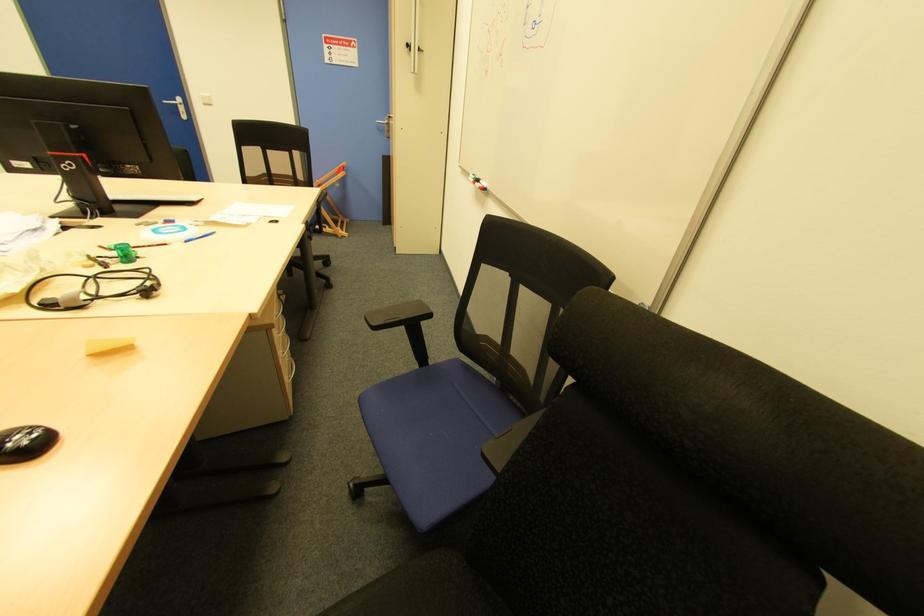
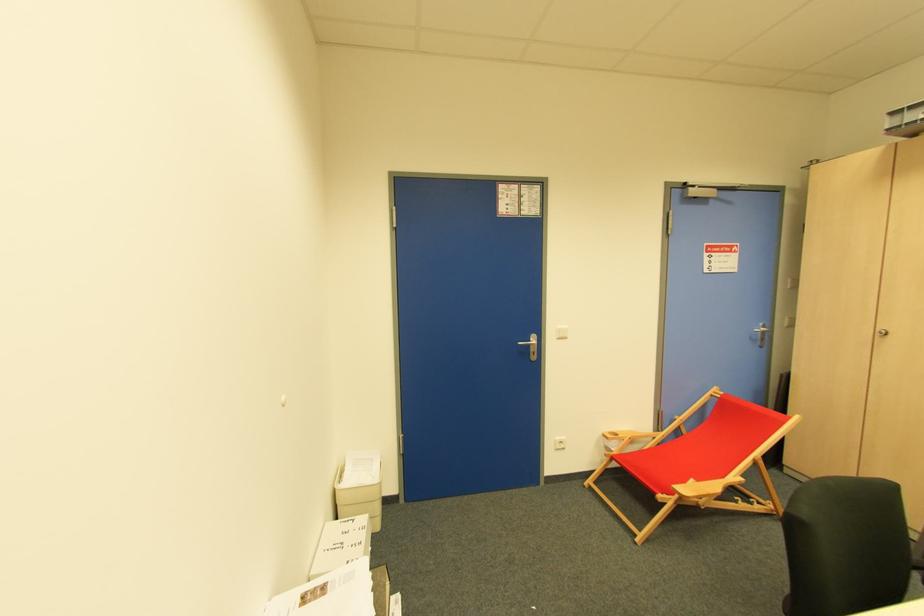
Question: Which direction would the cameraman need to move to produce the second image? Reply with the corresponding letter.

Choices:
 (A) Left
 (B) Right
 (C) Forward
 (D) Backward

Answer: (A)